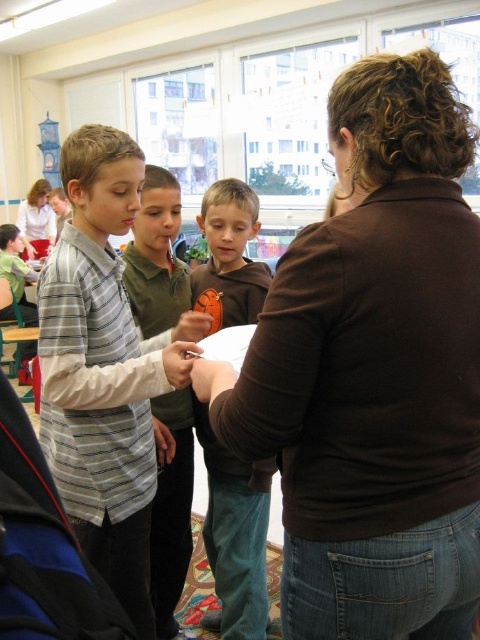
You are a photographer standing in the classroom and want to take a photo of both the point at coordinates (166,584) and the point at (193,353). Since you want both points to be in focus, which point should you focus on to ensure both are sharp?

Result: You should focus on the point closer to the camera, which is point (166,584), to ensure both points are in focus. This is because focusing on the closer object maximizes the depth of field, allowing the farther point to still be sharp.

You are standing in the classroom and want to move from point (x=322, y=540) to point (x=192, y=323). Which direction should you move to get closer to the camera?

To move closer to the camera, you should move towards point (x=322, y=540) because it is closer to the camera than point (x=192, y=323).